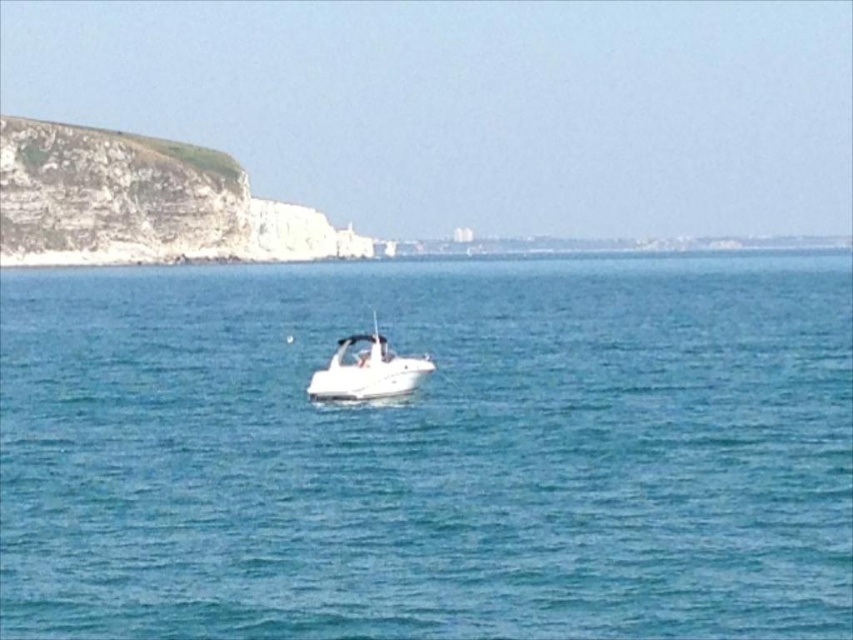
Describe the element at coordinates (142, 202) in the screenshot. This screenshot has height=640, width=853. I see `white rocky cliff at upper left` at that location.

Image resolution: width=853 pixels, height=640 pixels. What are the coordinates of `white rocky cliff at upper left` in the screenshot? It's located at (142, 202).

This screenshot has width=853, height=640. Find the location of `white rocky cliff at upper left`. white rocky cliff at upper left is located at coordinates (142, 202).

Can you confirm if clear blue water at center is wider than white rocky cliff at upper left?

Yes.

Does clear blue water at center appear over white rocky cliff at upper left?

Incorrect, clear blue water at center is not positioned above white rocky cliff at upper left.

Is point (70, 362) behind point (171, 182)?

No, (70, 362) is closer to viewer.

Locate an element on the screen. clear blue water at center is located at coordinates (428, 451).

Between point (663, 346) and point (337, 380), which one is positioned in front?

Point (337, 380) is in front.

Where is `clear blue water at center`? The height and width of the screenshot is (640, 853). clear blue water at center is located at coordinates (428, 451).